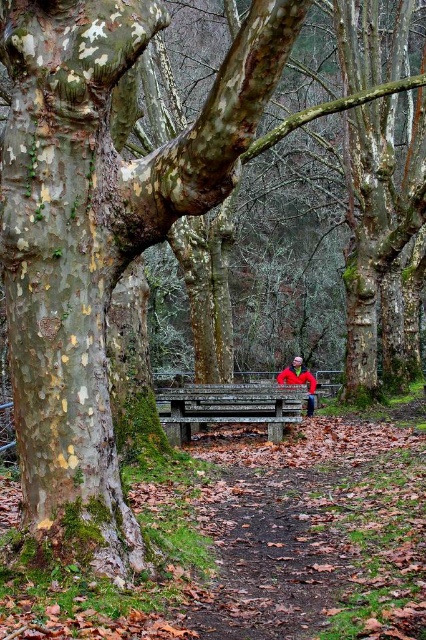
Question: Does wooden bench at center lie in front of red jacket at center?

Choices:
 (A) no
 (B) yes

Answer: (B)

Question: Which object is closer to the camera taking this photo?

Choices:
 (A) red jacket at center
 (B) wooden bench at center

Answer: (B)

Question: Which object is farther from the camera taking this photo?

Choices:
 (A) red jacket at center
 (B) wooden bench at center

Answer: (A)

Question: Can you confirm if wooden bench at center is smaller than red jacket at center?

Choices:
 (A) yes
 (B) no

Answer: (A)

Question: Among these objects, which one is nearest to the camera?

Choices:
 (A) red jacket at center
 (B) wooden bench at center

Answer: (B)

Question: Is wooden bench at center in front of red jacket at center?

Choices:
 (A) no
 (B) yes

Answer: (B)